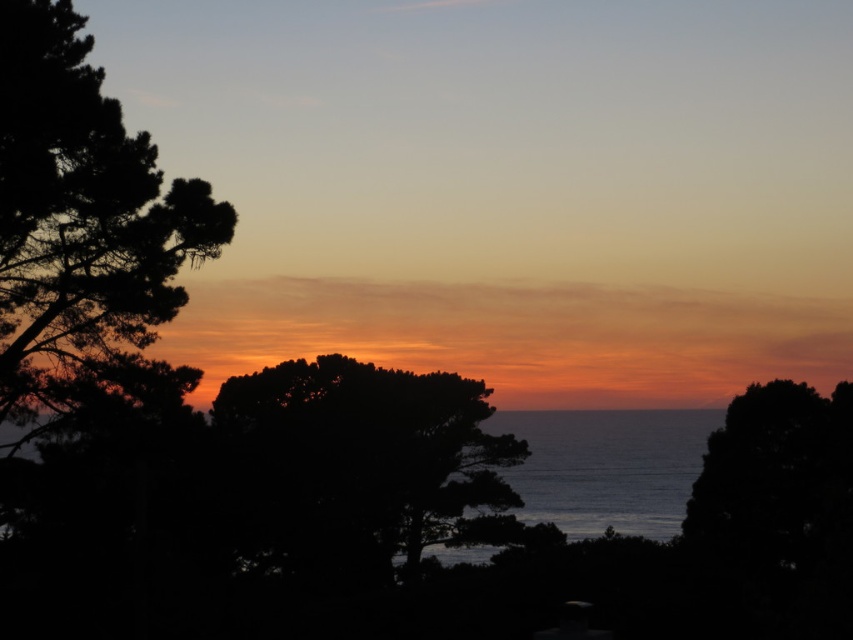
Which is above, dark green leafy tree at center or blue water at center?

dark green leafy tree at center

Identify the location of dark green leafy tree at center. The width and height of the screenshot is (853, 640). (360, 465).

Who is more forward, (83,387) or (589,412)?

Point (83,387) is more forward.

Is dark green leafy tree at left to the right of blue water at center from the viewer's perspective?

Incorrect, dark green leafy tree at left is not on the right side of blue water at center.

Is point (39, 214) more distant than point (581, 428)?

No, (39, 214) is closer to viewer.

The width and height of the screenshot is (853, 640). Identify the location of dark green leafy tree at left. (82, 228).

Between dark green leafy tree at left and dark green leafy tree at center, which one appears on the right side from the viewer's perspective?

dark green leafy tree at center is more to the right.

Who is more forward, (32, 428) or (241, 502)?

Point (32, 428) is more forward.

Identify the location of dark green leafy tree at left. Image resolution: width=853 pixels, height=640 pixels. (82, 228).